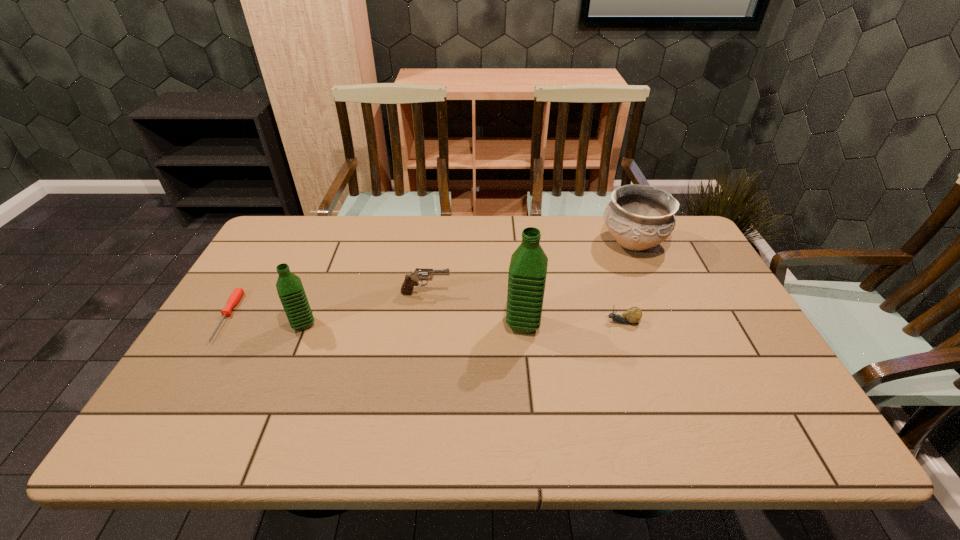
At what (x,y) coordinates should I click in order to perform the action: click on escargot. Please return your answer as a coordinate pair (x, y). The height and width of the screenshot is (540, 960). Looking at the image, I should click on (633, 315).

Find the location of `free space located 0.180m on the left of the fifth shortest object`. free space located 0.180m on the left of the fifth shortest object is located at coordinates click(x=223, y=325).

Where is `free space located 0.060m on the back of the fourth object from left to right`? free space located 0.060m on the back of the fourth object from left to right is located at coordinates (520, 296).

Locate an element on the screen. This screenshot has width=960, height=540. free space located on the left of the pottery is located at coordinates (556, 243).

I want to click on vacant space situated at the barrel of the third shortest object, so click(500, 293).

Where is `vacant space located 0.120m at the tip of the leftmost object`? The image size is (960, 540). vacant space located 0.120m at the tip of the leftmost object is located at coordinates (188, 383).

Locate an element on the screen. This screenshot has width=960, height=540. vacant area located on the front-facing side of the fifth tallest object is located at coordinates (456, 322).

You are a GUI agent. You are given a task and a screenshot of the screen. Output one action in this format:
    pyautogui.click(x=<x>, y=<y>)
    Task: Click on the free spot located 0.050m on the front-facing side of the fifth tallest object
    
    Given the screenshot: What is the action you would take?
    pyautogui.click(x=586, y=322)

This screenshot has width=960, height=540. Find the location of `free space located 0.200m on the front-facing side of the fifth tallest object`. free space located 0.200m on the front-facing side of the fifth tallest object is located at coordinates (530, 322).

The image size is (960, 540). In order to click on object that is at the far edge in this screenshot , I will do `click(639, 217)`.